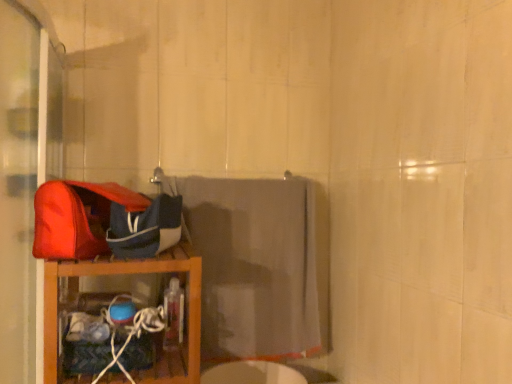
Question: Are matte red shoulder bag at left and wooden shelf at left far apart?

Choices:
 (A) no
 (B) yes

Answer: (A)

Question: Is matte red shoulder bag at left oriented towards wooden shelf at left?

Choices:
 (A) yes
 (B) no

Answer: (B)

Question: Considering the relative sizes of matte red shoulder bag at left and wooden shelf at left in the image provided, is matte red shoulder bag at left smaller than wooden shelf at left?

Choices:
 (A) yes
 (B) no

Answer: (A)

Question: Does matte red shoulder bag at left appear on the right side of wooden shelf at left?

Choices:
 (A) no
 (B) yes

Answer: (A)

Question: Is matte red shoulder bag at left further to the viewer compared to wooden shelf at left?

Choices:
 (A) no
 (B) yes

Answer: (A)

Question: From a real-world perspective, is matte red shoulder bag at left positioned over wooden shelf at left based on gravity?

Choices:
 (A) yes
 (B) no

Answer: (A)

Question: Is wooden shelf at left facing away from gray fabric towel at center?

Choices:
 (A) no
 (B) yes

Answer: (A)

Question: Is wooden shelf at left to the left of gray fabric towel at center from the viewer's perspective?

Choices:
 (A) yes
 (B) no

Answer: (A)

Question: From the image's perspective, is wooden shelf at left beneath gray fabric towel at center?

Choices:
 (A) no
 (B) yes

Answer: (B)

Question: Is wooden shelf at left to the right of gray fabric towel at center from the viewer's perspective?

Choices:
 (A) yes
 (B) no

Answer: (B)

Question: From the image's perspective, is wooden shelf at left on gray fabric towel at center?

Choices:
 (A) yes
 (B) no

Answer: (B)

Question: Can you confirm if wooden shelf at left is bigger than gray fabric towel at center?

Choices:
 (A) yes
 (B) no

Answer: (B)

Question: Is matte red shoulder bag at left positioned behind blue fabric bag at left?

Choices:
 (A) no
 (B) yes

Answer: (A)